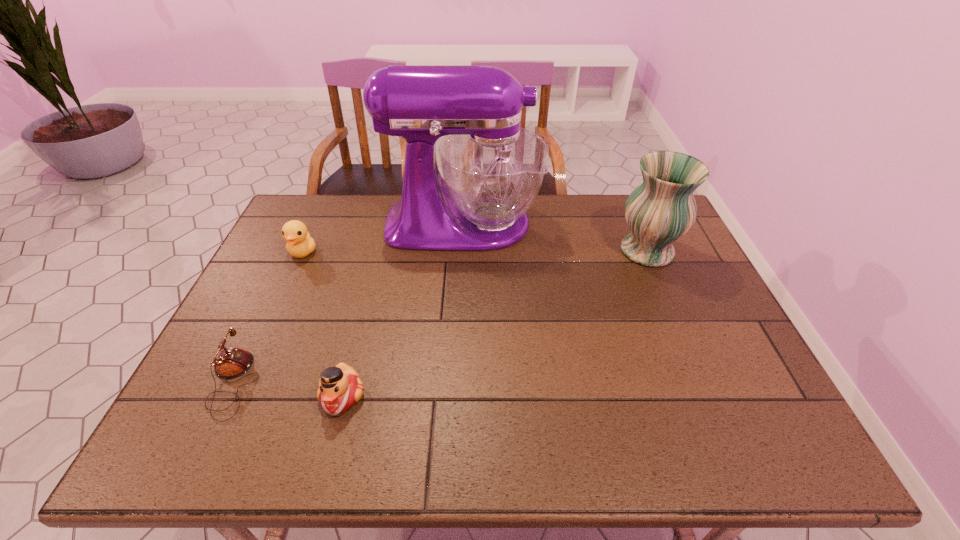
Where is `free space that satisfies the following two spatial constraints: 1. at the bowl opening of the tallest object; 2. on the back side of the rightmost object`? Image resolution: width=960 pixels, height=540 pixels. free space that satisfies the following two spatial constraints: 1. at the bowl opening of the tallest object; 2. on the back side of the rightmost object is located at coordinates (462, 251).

The width and height of the screenshot is (960, 540). What are the coordinates of `vacant space that satisfies the following two spatial constraints: 1. at the bowl opening of the tallest object; 2. on the face of the left duck` in the screenshot? It's located at (462, 252).

Where is `vacant area that satisfies the following two spatial constraints: 1. at the bowl opening of the mixer; 2. on the face of the farther duck`? vacant area that satisfies the following two spatial constraints: 1. at the bowl opening of the mixer; 2. on the face of the farther duck is located at coordinates (462, 252).

You are a GUI agent. You are given a task and a screenshot of the screen. Output one action in this format:
    pyautogui.click(x=<x>, y=<y>)
    Task: Click on the blank space that satisfies the following two spatial constraints: 1. at the bowl opening of the tallest object; 2. on the right side of the fourth shortest object
    The image size is (960, 540).
    Given the screenshot: What is the action you would take?
    pyautogui.click(x=462, y=251)

Identify the location of vacant region that satisfies the following two spatial constraints: 1. on the back side of the rightmost object; 2. at the bowl opening of the tallest object. The image size is (960, 540). (636, 224).